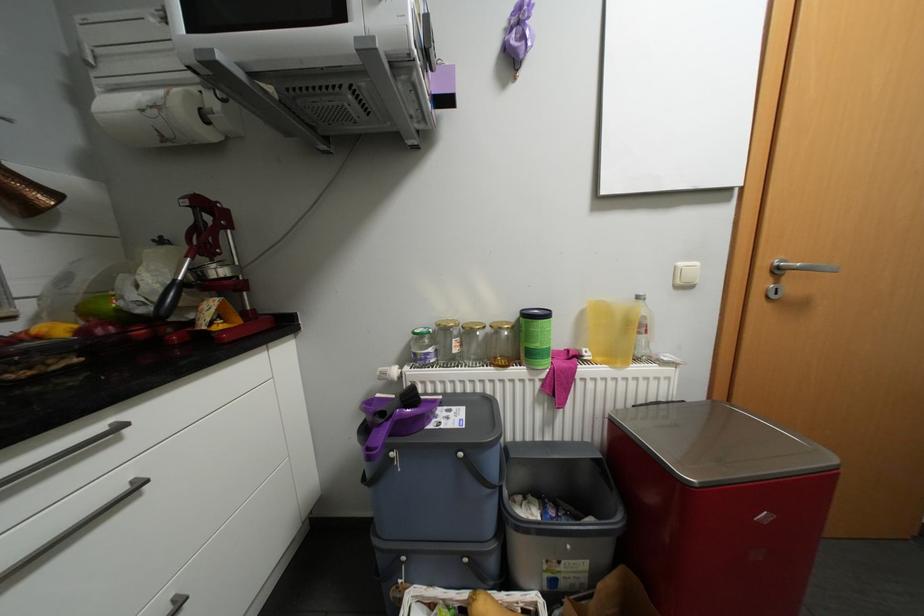
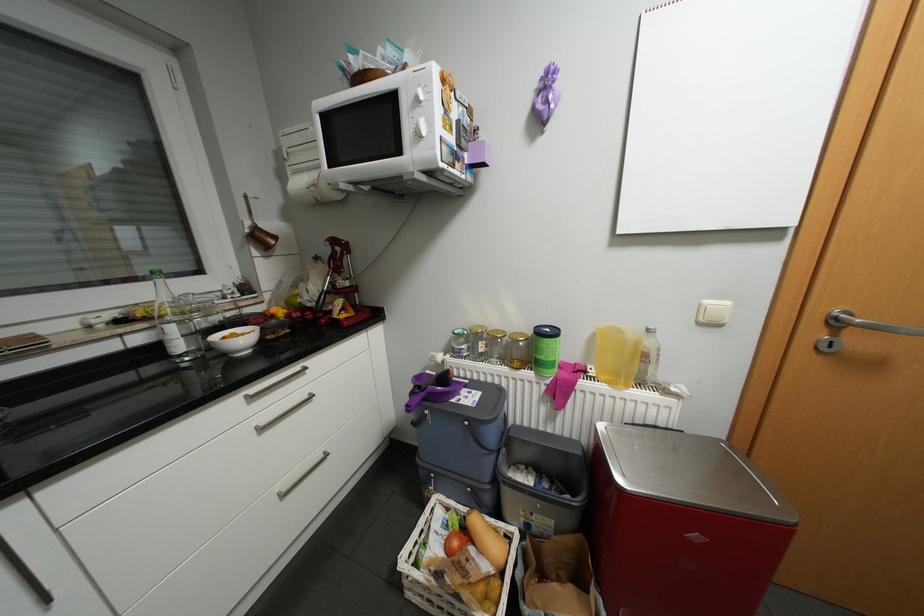
Find the pixel in the second image that matches point 556,421 in the first image.

(558, 416)